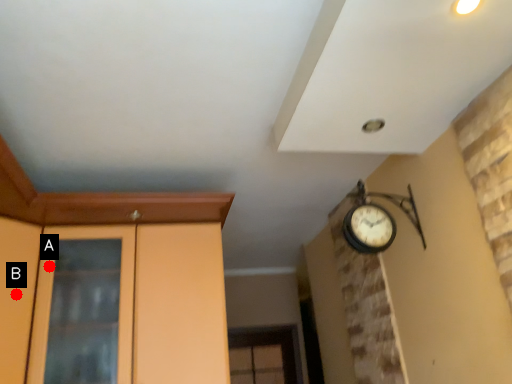
Question: Two points are circled on the image, labeled by A and B beside each circle. Which point is farther to the camera?

Choices:
 (A) A is further
 (B) B is further

Answer: (A)